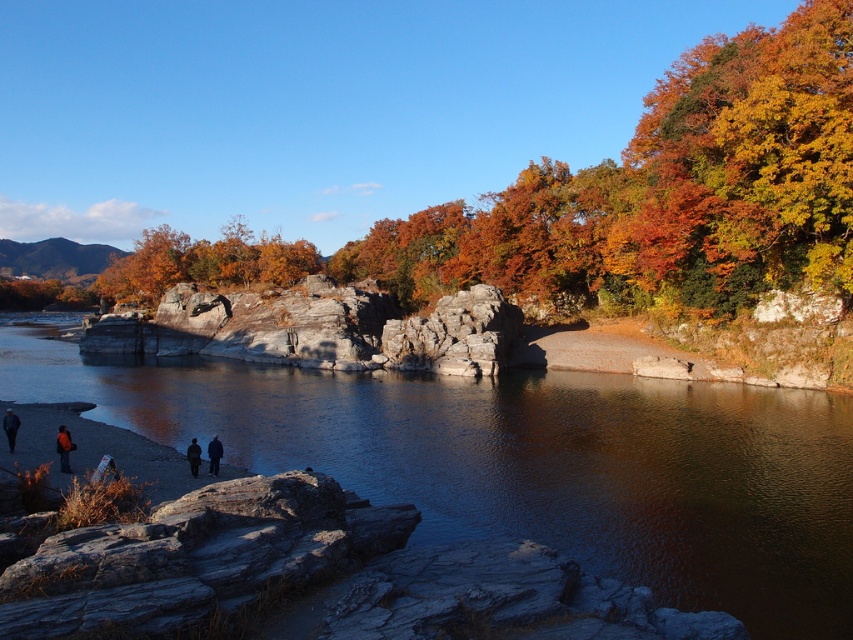
Is orange matte tree at upper right positioned in front of dark wool coat at center?

No, orange matte tree at upper right is behind dark wool coat at center.

Who is higher up, orange matte tree at upper right or dark wool coat at center?

orange matte tree at upper right is above.

Which is behind, point (740, 296) or point (210, 449)?

Positioned behind is point (740, 296).

Where is `orange matte tree at upper right`? The image size is (853, 640). orange matte tree at upper right is located at coordinates (666, 192).

Does orange fabric jacket at lower left have a smaller size compared to dark blue fabric at lower center?

No.

Who is lower down, orange fabric jacket at lower left or dark blue fabric at lower center?

dark blue fabric at lower center is lower down.

Is point (68, 472) behind point (193, 465)?

No, it is not.

Locate an element on the screen. Image resolution: width=853 pixels, height=640 pixels. orange fabric jacket at lower left is located at coordinates (62, 449).

Does smooth gray river at center have a greater width compared to orange fabric jacket at lower left?

Indeed, smooth gray river at center has a greater width compared to orange fabric jacket at lower left.

Is point (496, 381) farther from camera compared to point (67, 468)?

Yes.

Is point (624, 522) more distant than point (57, 433)?

No, it is not.

This screenshot has width=853, height=640. What are the coordinates of `smooth gray river at center` in the screenshot? It's located at (531, 464).